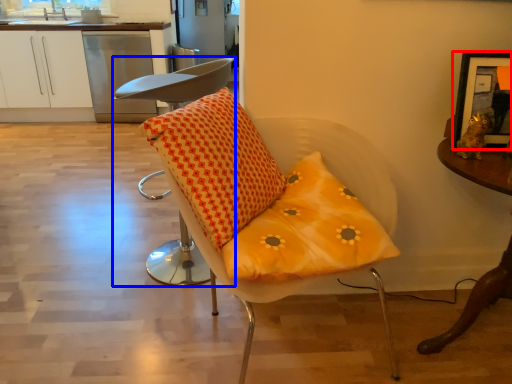
Question: Which of the following is the farthest to the observer, picture frame (highlighted by a red box) or chair (highlighted by a blue box)?

Choices:
 (A) picture frame
 (B) chair

Answer: (B)